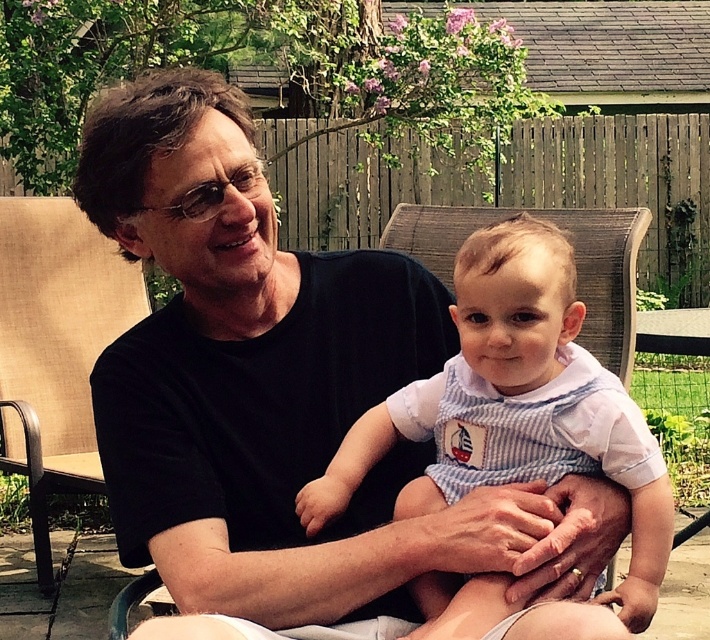
You are a photographer setting up for a family photo. You need to ensure that the black matte shirt at center and the blue striped overalls at center are both visible in the frame. Given their sizes, which one might require more careful positioning to avoid being overshadowed?

The blue striped overalls at center is smaller than the black matte shirt at center, so it might require more careful positioning to ensure it remains visible and isn not overshadowed by the larger object.

You are a photographer standing at the edge of the stone tile patio. You want to capture a photo of the black matte shirt at center and the baby in light blue and white striped outfit. How far apart should you position them to ensure both are in focus?

The black matte shirt at center and the baby in light blue and white striped outfit are 3.80 feet apart, so you should position them exactly 3.80 feet apart to ensure both are in focus.